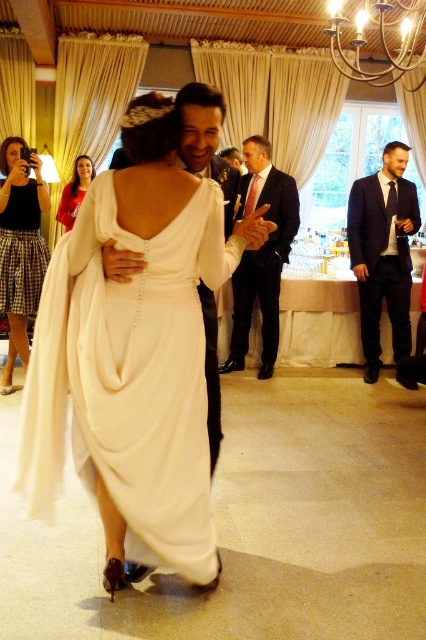
Who is lower down, dark blue suit at right or plaid skirt at lower left?

plaid skirt at lower left is below.

Who is more distant from viewer, (371, 177) or (42, 179)?

Point (371, 177)

Find the location of a particular element. dark blue suit at right is located at coordinates (382, 252).

Can you confirm if white satin dress at center is positioned above matte red dress at upper left?

No, white satin dress at center is not above matte red dress at upper left.

Can you confirm if white satin dress at center is positioned below matte red dress at upper left?

Indeed, white satin dress at center is positioned under matte red dress at upper left.

Who is more forward, (x=178, y=253) or (x=83, y=170)?

Positioned in front is point (x=178, y=253).

Where is `white satin dress at center`? white satin dress at center is located at coordinates (129, 378).

Which is more to the left, shiny black suit at center or matte red dress at upper left?

From the viewer's perspective, matte red dress at upper left appears more on the left side.

Can you confirm if shiny black suit at center is wider than matte red dress at upper left?

No, shiny black suit at center is not wider than matte red dress at upper left.

Measure the distance between point (187, 147) and camera.

Point (187, 147) is 1.84 meters away from camera.

Find the location of a particular element. The image size is (426, 640). shiny black suit at center is located at coordinates (206, 141).